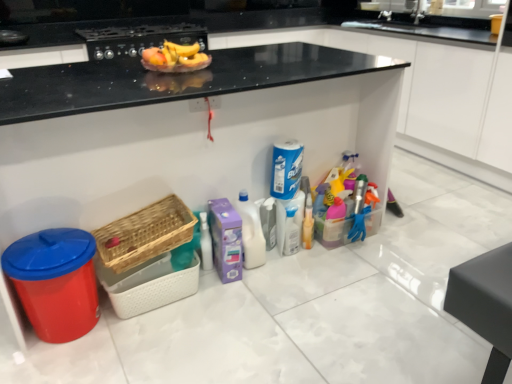
Question: Is woven wood basket at lower left, placed as the first basket when sorted from bottom to top, located within woven wood basket at lower left, which is counted as the second basket, starting from the bottom?

Choices:
 (A) no
 (B) yes

Answer: (A)

Question: Considering the relative sizes of woven wood basket at lower left, arranged as the 1th basket when viewed from the top, and woven wood basket at lower left, placed as the first basket when sorted from bottom to top, in the image provided, is woven wood basket at lower left, arranged as the 1th basket when viewed from the top, wider than woven wood basket at lower left, placed as the first basket when sorted from bottom to top,?

Choices:
 (A) no
 (B) yes

Answer: (B)

Question: From a real-world perspective, is woven wood basket at lower left, which is counted as the second basket, starting from the bottom, located beneath woven wood basket at lower left, acting as the second basket starting from the top?

Choices:
 (A) no
 (B) yes

Answer: (A)

Question: From the image's perspective, is woven wood basket at lower left, which is counted as the second basket, starting from the bottom, beneath woven wood basket at lower left, acting as the second basket starting from the top?

Choices:
 (A) yes
 (B) no

Answer: (B)

Question: Is woven wood basket at lower left, arranged as the 1th basket when viewed from the top, not near woven wood basket at lower left, acting as the second basket starting from the top?

Choices:
 (A) yes
 (B) no

Answer: (B)

Question: Does woven wood basket at lower left, arranged as the 1th basket when viewed from the top, have a smaller size compared to woven wood basket at lower left, acting as the second basket starting from the top?

Choices:
 (A) yes
 (B) no

Answer: (B)

Question: Can you confirm if woven wood basket at lower left, which is counted as the second basket, starting from the bottom, is thinner than shiny plastic bowl at upper center?

Choices:
 (A) no
 (B) yes

Answer: (B)

Question: Is woven wood basket at lower left, arranged as the 1th basket when viewed from the top, looking in the opposite direction of shiny plastic bowl at upper center?

Choices:
 (A) yes
 (B) no

Answer: (B)

Question: Can you confirm if woven wood basket at lower left, arranged as the 1th basket when viewed from the top, is positioned to the left of shiny plastic bowl at upper center?

Choices:
 (A) yes
 (B) no

Answer: (A)

Question: From a real-world perspective, is woven wood basket at lower left, which is counted as the second basket, starting from the bottom, on top of shiny plastic bowl at upper center?

Choices:
 (A) yes
 (B) no

Answer: (B)

Question: Does woven wood basket at lower left, which is counted as the second basket, starting from the bottom, lie behind shiny plastic bowl at upper center?

Choices:
 (A) no
 (B) yes

Answer: (A)

Question: Can you confirm if woven wood basket at lower left, which is counted as the second basket, starting from the bottom, is positioned to the right of shiny plastic bowl at upper center?

Choices:
 (A) no
 (B) yes

Answer: (A)

Question: Is woven wood basket at lower left, placed as the first basket when sorted from bottom to top, aimed at matte black stove at upper center?

Choices:
 (A) yes
 (B) no

Answer: (B)